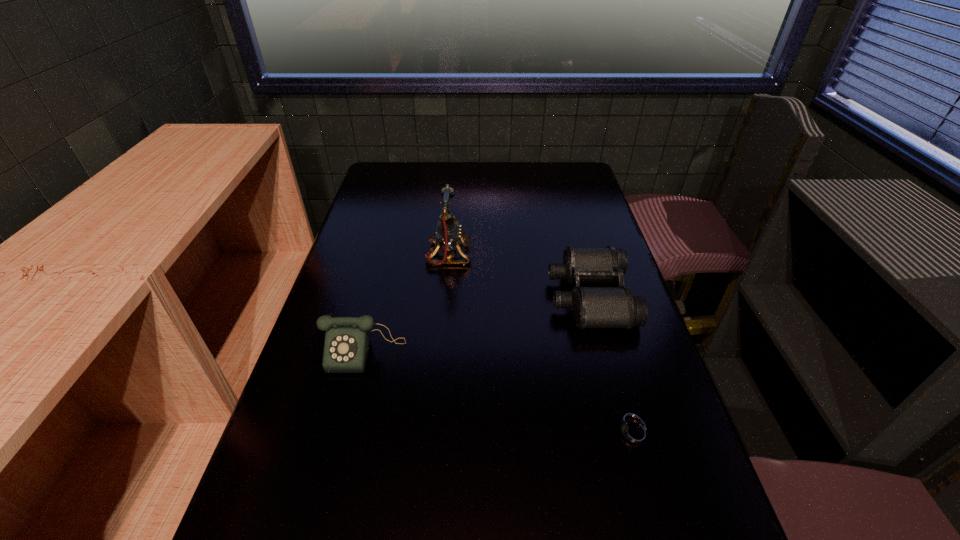
Locate an element on the screen. the taller telephone is located at coordinates (448, 235).

You are a GUI agent. You are given a task and a screenshot of the screen. Output one action in this format:
    pyautogui.click(x=<x>, y=<y>)
    Task: Click on the third object from right to left
    The height and width of the screenshot is (540, 960).
    Given the screenshot: What is the action you would take?
    pyautogui.click(x=448, y=235)

At what (x,y) coordinates should I click in order to perform the action: click on binoculars. Please return your answer as a coordinate pair (x, y). The height and width of the screenshot is (540, 960). Looking at the image, I should click on (592, 307).

I want to click on the shorter telephone, so [347, 344].

At what (x,y) coordinates should I click in order to perform the action: click on the nearer telephone. Please return your answer as a coordinate pair (x, y). The image size is (960, 540). Looking at the image, I should click on (347, 344).

Where is `the shortest object`? the shortest object is located at coordinates pyautogui.click(x=634, y=434).

Where is `the nearest object`? Image resolution: width=960 pixels, height=540 pixels. the nearest object is located at coordinates (634, 434).

Identify the location of free region located on the front of the right telephone, featuring the rotary dial. (501, 255).

What are the coordinates of `blank space located through the eyepieces of the binoculars` in the screenshot? It's located at (428, 296).

Locate an element on the screen. This screenshot has width=960, height=540. vacant space located 0.070m through the eyepieces of the binoculars is located at coordinates (524, 296).